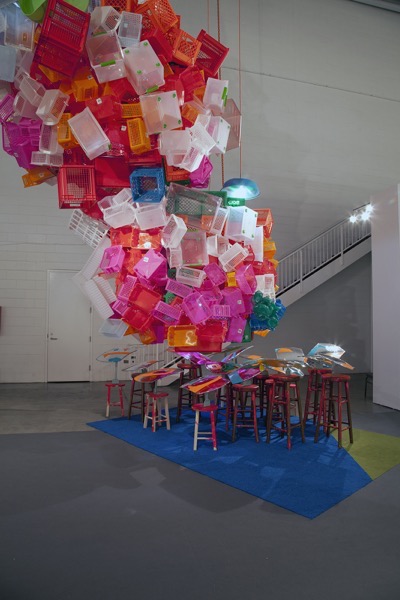
The image size is (400, 600). Identify the location of pink crates/bins. (197, 304), (148, 265), (247, 281).